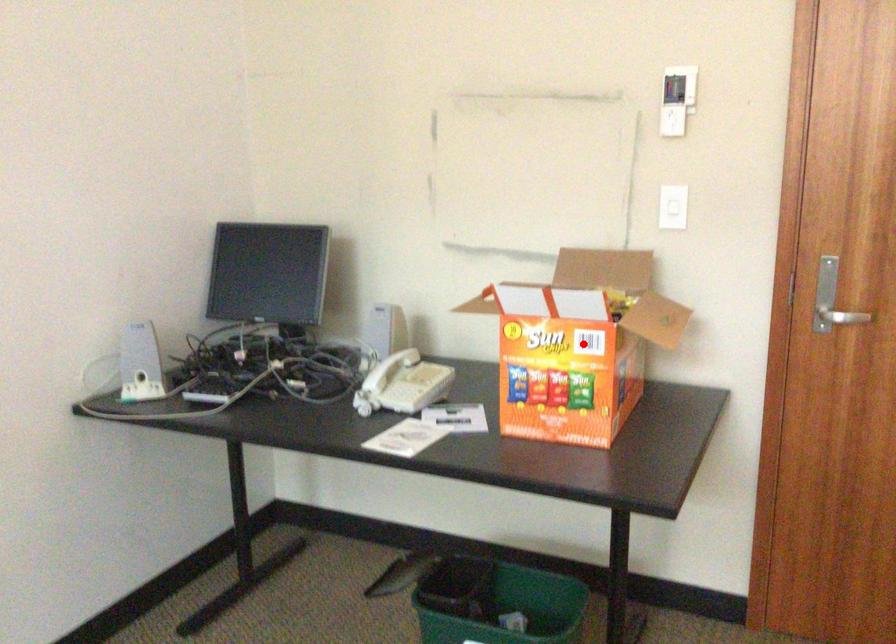
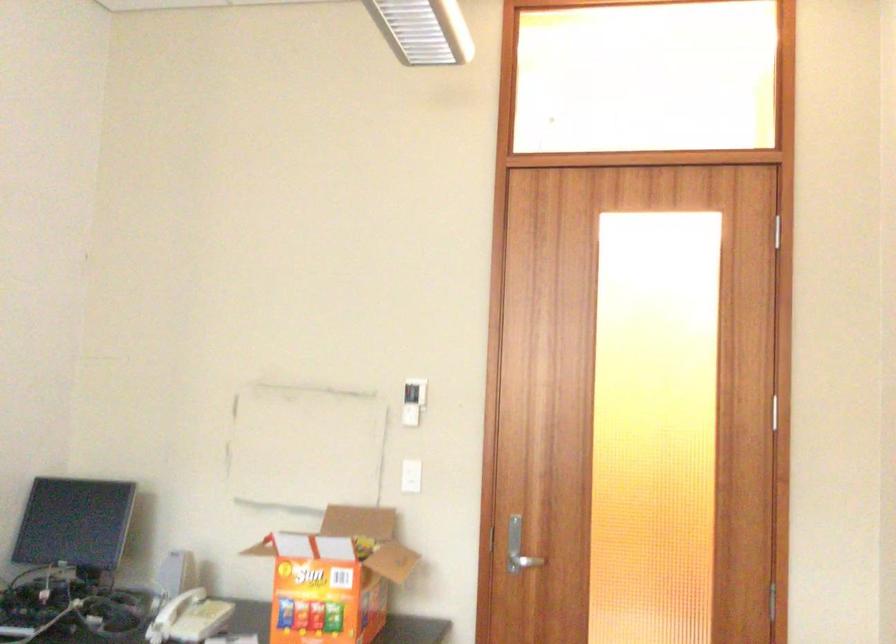
Question: I am providing you with two images of the same scene from different viewpoints. Given a red point in image1, look at the same physical point in image2. Is it:

Choices:
 (A) Closer to the viewpoint
 (B) Farther from the viewpoint

Answer: (B)